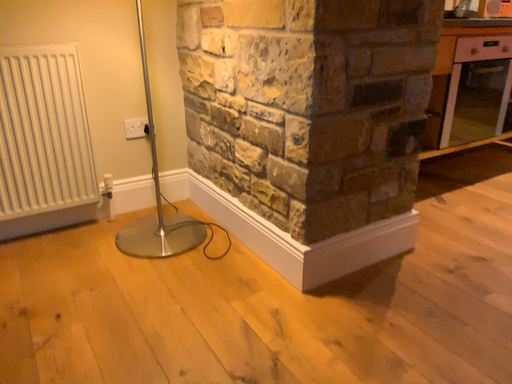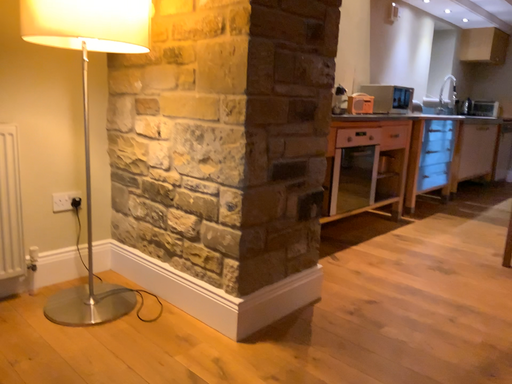
Question: How did the camera likely rotate when shooting the video?

Choices:
 (A) rotated left
 (B) rotated right

Answer: (B)